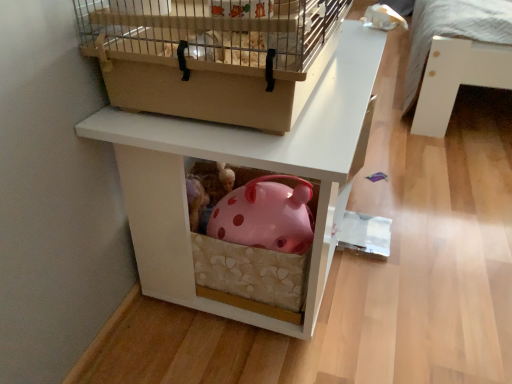
The image size is (512, 384). What do you see at coordinates (240, 164) in the screenshot?
I see `pink polka dot piggy bank at center` at bounding box center [240, 164].

At what (x,y) coordinates should I click in order to perform the action: click on pink polka dot piggy bank at center. Please return your answer as a coordinate pair (x, y). Image resolution: width=512 pixels, height=384 pixels. Looking at the image, I should click on (240, 164).

The image size is (512, 384). I want to click on wooden birdcage at upper center, so click(x=213, y=56).

The width and height of the screenshot is (512, 384). What do you see at coordinates (213, 56) in the screenshot?
I see `wooden birdcage at upper center` at bounding box center [213, 56].

Locate an element on the screen. This screenshot has width=512, height=384. pink polka dot piggy bank at center is located at coordinates (240, 164).

In the image, is wooden birdcage at upper center on the left side or the right side of pink polka dot piggy bank at center?

From the image, it's evident that wooden birdcage at upper center is to the left of pink polka dot piggy bank at center.

Which object is closer to the camera, wooden birdcage at upper center or pink polka dot piggy bank at center?

wooden birdcage at upper center is closer to the camera.

Is point (89, 6) positioned before point (330, 131)?

Yes, point (89, 6) is in front of point (330, 131).

Based on the photo, from the image's perspective, relative to pink polka dot piggy bank at center, is wooden birdcage at upper center above or below?

From the image's perspective, wooden birdcage at upper center appears above pink polka dot piggy bank at center.

From a real-world perspective, which object stands above the other?

wooden birdcage at upper center.

Considering the relative sizes of wooden birdcage at upper center and pink polka dot piggy bank at center in the image provided, is wooden birdcage at upper center thinner than pink polka dot piggy bank at center?

Yes.

Between wooden birdcage at upper center and pink polka dot piggy bank at center, which one has less height?

Standing shorter between the two is wooden birdcage at upper center.

Which of these two, wooden birdcage at upper center or pink polka dot piggy bank at center, is smaller?

With smaller size is wooden birdcage at upper center.

Do you think wooden birdcage at upper center is within pink polka dot piggy bank at center, or outside of it?

wooden birdcage at upper center lies outside pink polka dot piggy bank at center.

Is wooden birdcage at upper center next to pink polka dot piggy bank at center and touching it?

There is a gap between wooden birdcage at upper center and pink polka dot piggy bank at center.

In the scene shown: Is pink polka dot piggy bank at center at the back of wooden birdcage at upper center?

No, wooden birdcage at upper center is not facing the opposite direction of pink polka dot piggy bank at center.

Consider the image. Can you tell me how much wooden birdcage at upper center and pink polka dot piggy bank at center differ in facing direction?

The facing directions of wooden birdcage at upper center and pink polka dot piggy bank at center are 3.91e-06 degrees apart.

Find the location of `bird cage to the left of pink polka dot piggy bank at center`. bird cage to the left of pink polka dot piggy bank at center is located at coordinates (213, 56).

Which object is positioned more to the left, pink polka dot piggy bank at center or wooden birdcage at upper center?

From the viewer's perspective, wooden birdcage at upper center appears more on the left side.

Which object is further away from the camera taking this photo, pink polka dot piggy bank at center or wooden birdcage at upper center?

pink polka dot piggy bank at center is further away from the camera.

Is point (353, 64) positioned in front of point (88, 52)?

That is False.

From the image's perspective, is pink polka dot piggy bank at center on wooden birdcage at upper center?

No, from the image's perspective, pink polka dot piggy bank at center is not above wooden birdcage at upper center.

From a real-world perspective, which object rests below the other?

pink polka dot piggy bank at center is physically lower.

Based on the photo, can you confirm if pink polka dot piggy bank at center is wider than wooden birdcage at upper center?

Correct, the width of pink polka dot piggy bank at center exceeds that of wooden birdcage at upper center.

Is pink polka dot piggy bank at center taller than wooden birdcage at upper center?

Yes.

Which of these two, pink polka dot piggy bank at center or wooden birdcage at upper center, is smaller?

wooden birdcage at upper center is smaller.

Is pink polka dot piggy bank at center located outside wooden birdcage at upper center?

Absolutely, pink polka dot piggy bank at center is external to wooden birdcage at upper center.

Can you see pink polka dot piggy bank at center touching wooden birdcage at upper center?

No, pink polka dot piggy bank at center is not touching wooden birdcage at upper center.

Is pink polka dot piggy bank at center facing away from wooden birdcage at upper center?

No, pink polka dot piggy bank at center's orientation is not away from wooden birdcage at upper center.

How different are the orientations of pink polka dot piggy bank at center and wooden birdcage at upper center in degrees?

There is a 3.91e-06-degree angle between the facing directions of pink polka dot piggy bank at center and wooden birdcage at upper center.

Measure the distance from pink polka dot piggy bank at center to wooden birdcage at upper center.

They are 4.61 inches apart.

Where is `furniture that appears on the right of wooden birdcage at upper center`? The image size is (512, 384). furniture that appears on the right of wooden birdcage at upper center is located at coordinates (240, 164).

I want to click on furniture behind the wooden birdcage at upper center, so click(x=240, y=164).

The height and width of the screenshot is (384, 512). Identify the location of bird cage in front of the pink polka dot piggy bank at center. (213, 56).